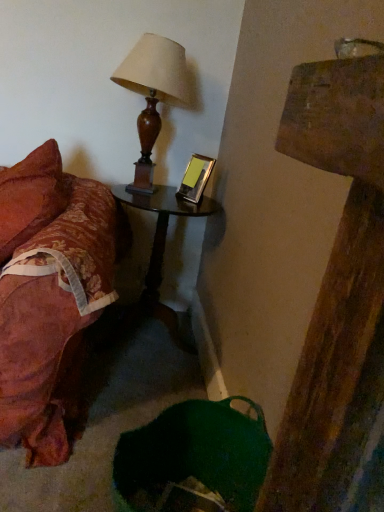
Question: Considering the positions of black glossy nightstand at center and metallic silver picture frame at upper right in the image, is black glossy nightstand at center wider or thinner than metallic silver picture frame at upper right?

Choices:
 (A) wide
 (B) thin

Answer: (A)

Question: From the image's perspective, is black glossy nightstand at center above or below metallic silver picture frame at upper right?

Choices:
 (A) below
 (B) above

Answer: (A)

Question: Estimate the real-world distances between objects in this image. Which object is closer to the wooden lampshade at upper left?

Choices:
 (A) metallic silver picture frame at upper right
 (B) black glossy nightstand at center

Answer: (A)

Question: Which object is the closest to the black glossy nightstand at center?

Choices:
 (A) metallic silver picture frame at upper right
 (B) wooden lampshade at upper left

Answer: (A)